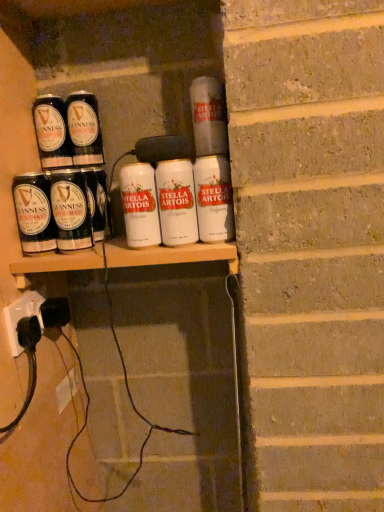
Question: From the image's perspective, is matte black can at left, which is the 3th tin can in left-to-right order, above or below matte black guinness can at upper left, arranged as the 1th tin can when viewed from the left?

Choices:
 (A) above
 (B) below

Answer: (B)

Question: From a real-world perspective, relative to matte black guinness can at upper left, arranged as the 1th tin can when viewed from the left, is matte black can at left, which is the 3th tin can in left-to-right order, vertically above or below?

Choices:
 (A) above
 (B) below

Answer: (B)

Question: Estimate the real-world distances between objects in this image. Which object is farther from the matte black can at left, the 7th tin can viewed from the right?

Choices:
 (A) white matte stella artois can at center, the 1th tin can positioned from the right
 (B) white matte stella artois can at center, which ranks as the 3th tin can in right-to-left order
 (C) shiny black can at left, positioned as the 5th tin can in right-to-left order
 (D) matte black guinness can at upper left, arranged as the 1th tin can when viewed from the left
 (E) matte black can at left, the 6th tin can when ordered from right to left

Answer: (A)

Question: Which is farther from the white matte stella artois can at center, which is the 6th tin can in left-to-right order?

Choices:
 (A) white matte tin can at center, which ranks as the fourth tin can in right-to-left order
 (B) matte black guinness can at upper left, arranged as the 1th tin can when viewed from the left
 (C) white matte stella artois can at center, the eighth tin can when ordered from left to right
 (D) matte black can at left, the 7th tin can viewed from the right
 (E) white plastic socket at lower left

Answer: (E)